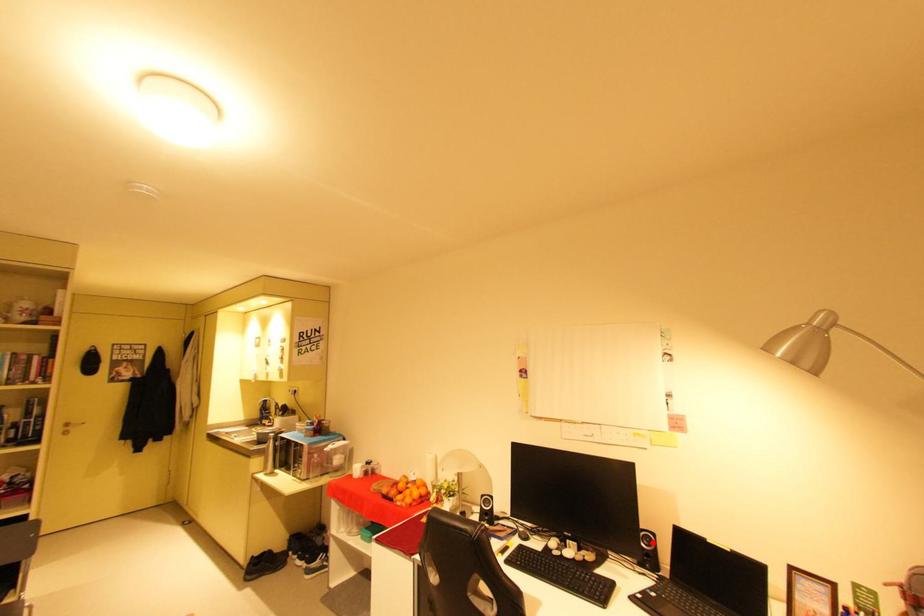
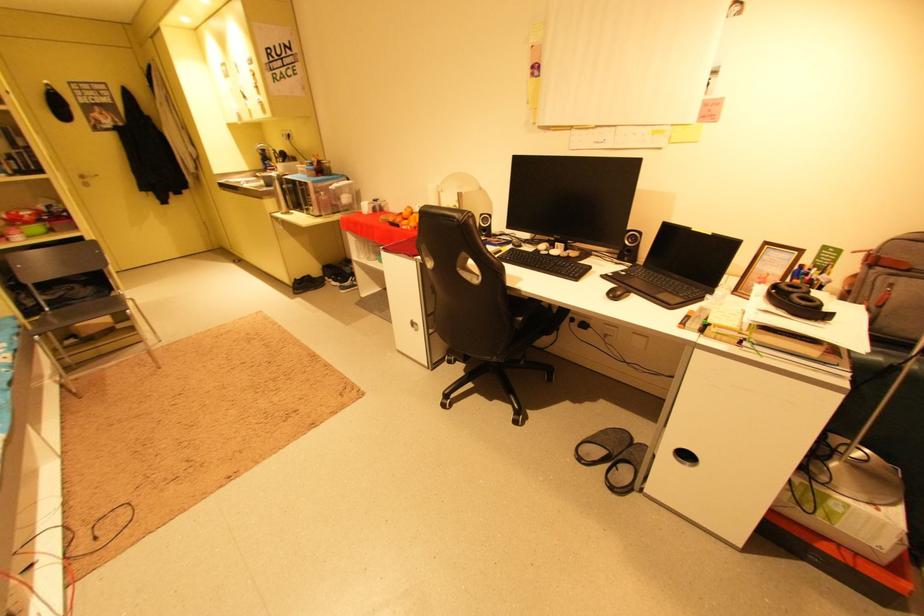
The point at the highlighted location is marked in the first image. Where is the corresponding point in the second image?

(638, 241)